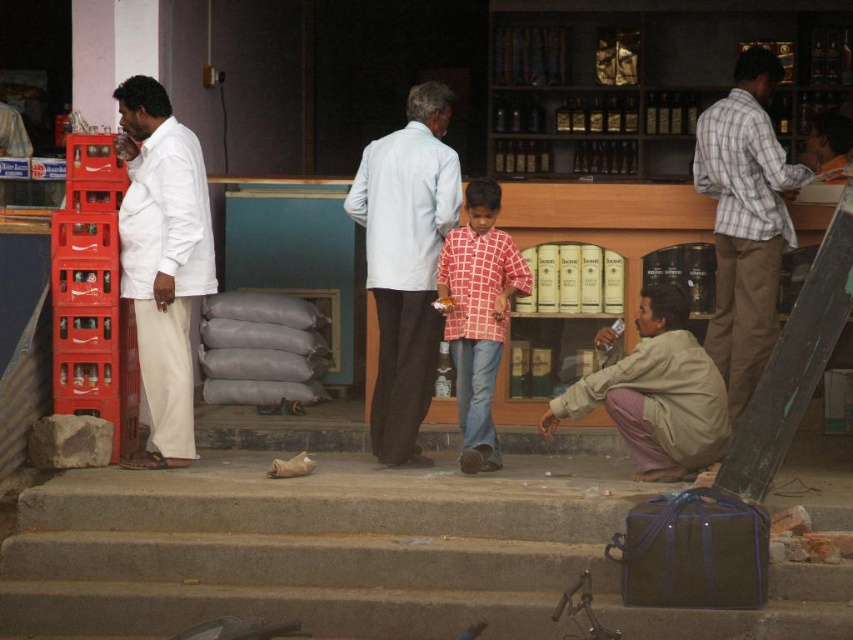
Question: Considering the relative positions of white cotton shirt at left and plaid shirt at right in the image provided, where is white cotton shirt at left located with respect to plaid shirt at right?

Choices:
 (A) above
 (B) below

Answer: (B)

Question: Does plaid shirt at right have a greater width compared to red checkered shirt at center?

Choices:
 (A) no
 (B) yes

Answer: (B)

Question: Which point is farther from the camera taking this photo?

Choices:
 (A) (608, 376)
 (B) (494, 444)
 (C) (409, 216)

Answer: (B)

Question: Is white cotton shirt at left to the right of beige cotton shirt at lower right from the viewer's perspective?

Choices:
 (A) no
 (B) yes

Answer: (A)

Question: Which of the following is the closest to the observer?

Choices:
 (A) (671, 400)
 (B) (801, 184)

Answer: (A)

Question: Based on their relative distances, which object is nearer to the plaid shirt at right?

Choices:
 (A) white cotton shirt at left
 (B) beige cotton shirt at lower right

Answer: (B)